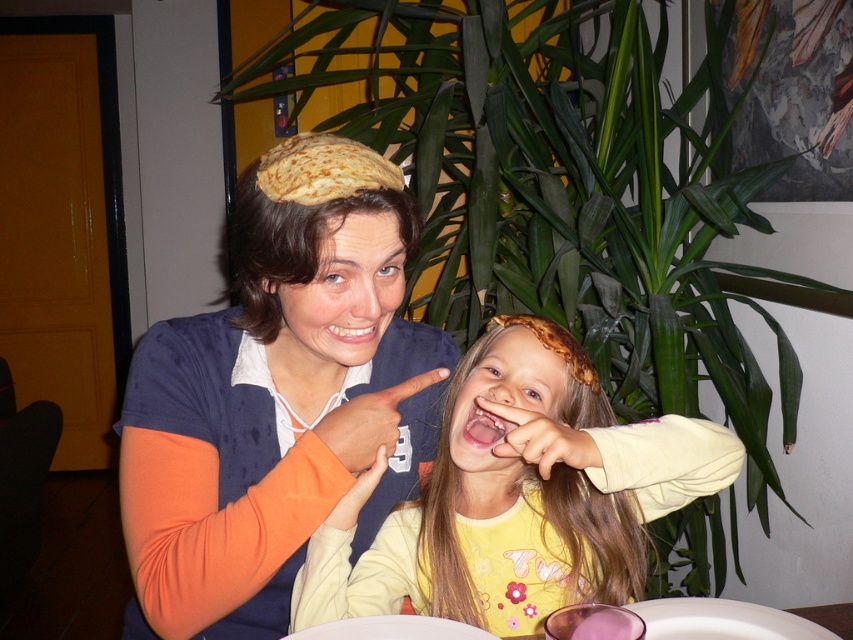
Question: Among these objects, which one is nearest to the camera?

Choices:
 (A) yellow matte shirt at center
 (B) matte brown beret at upper center

Answer: (B)

Question: Among these objects, which one is farthest from the camera?

Choices:
 (A) matte brown beret at upper center
 (B) yellow matte shirt at center

Answer: (B)

Question: Does matte brown beret at upper center appear over yellow matte shirt at center?

Choices:
 (A) no
 (B) yes

Answer: (B)

Question: In this image, where is matte brown beret at upper center located relative to yellow matte shirt at center?

Choices:
 (A) above
 (B) below

Answer: (A)

Question: Is matte brown beret at upper center positioned before yellow matte shirt at center?

Choices:
 (A) no
 (B) yes

Answer: (B)